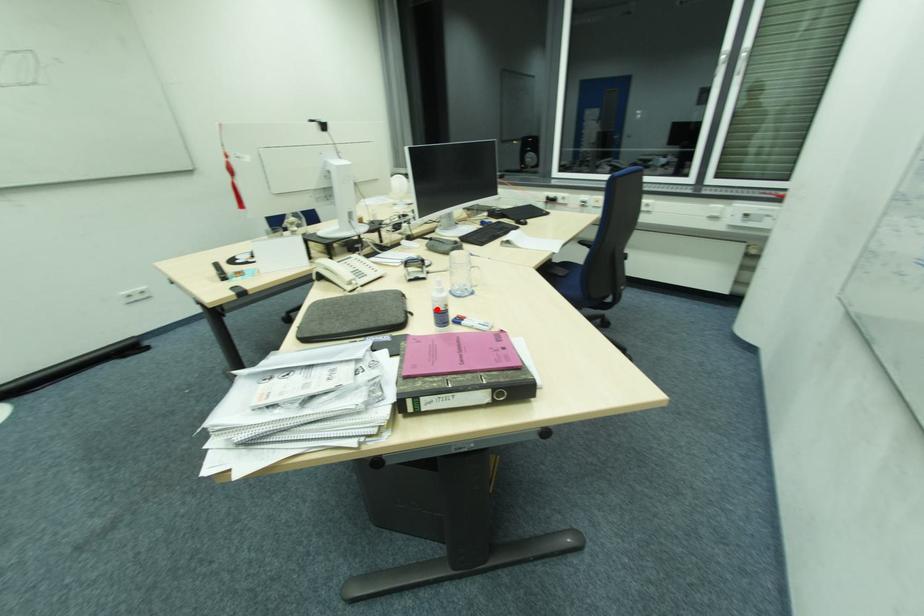
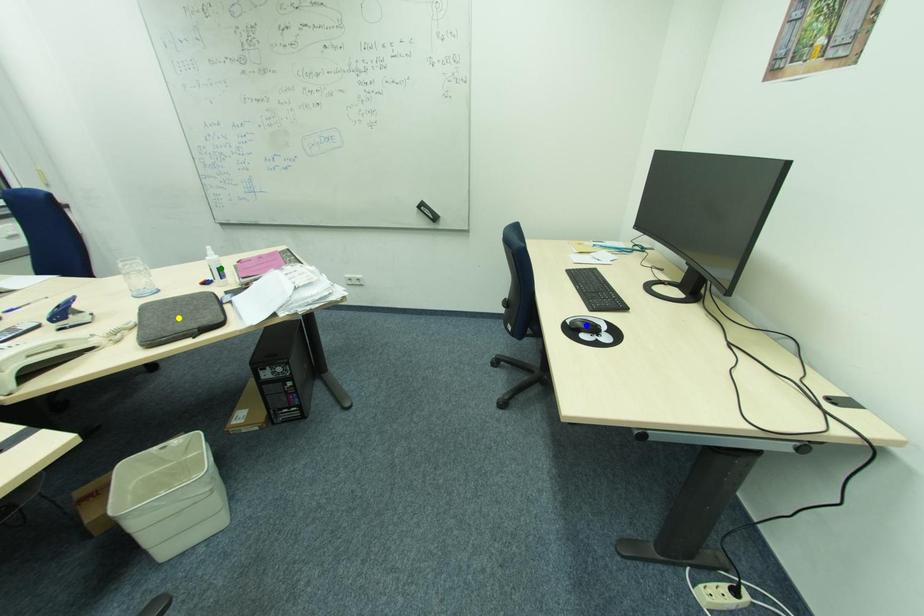
Question: I am providing you with two images of the same scene from different viewpoints. A red point is marked on the first image. You are given multiple points on the second image. Which point in image 2 is actually the same real-world point as the red point in image 1?

Choices:
 (A) yellow point
 (B) green point
 (C) blue point

Answer: (B)